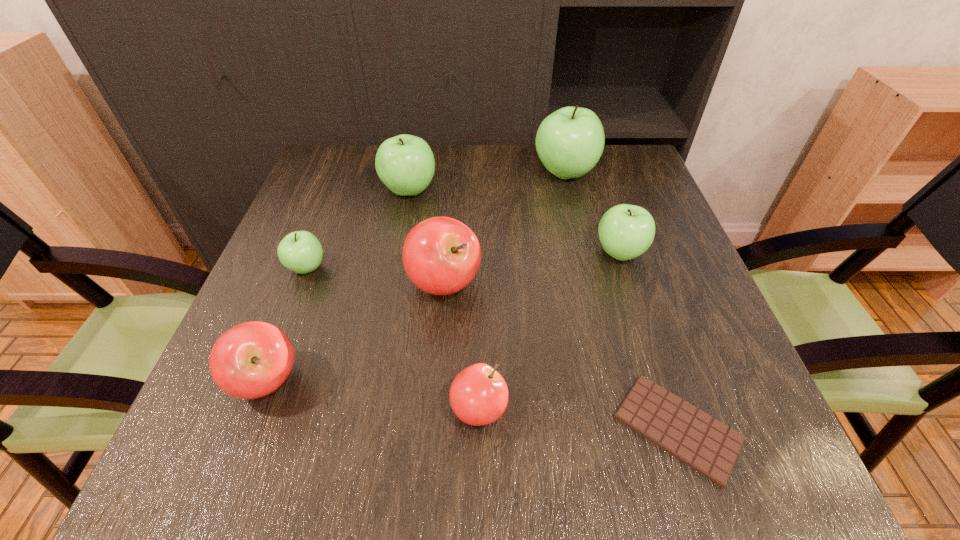
This screenshot has height=540, width=960. I want to click on vacant space situated 0.390m on the front of the biggest green apple, so click(x=598, y=311).

Where is `free space located on the right of the third green apple from right to left`? free space located on the right of the third green apple from right to left is located at coordinates (560, 190).

What are the coordinates of `vacant space situated 0.340m on the right of the farthest red apple` in the screenshot? It's located at (650, 283).

Identify the location of blank space located on the front of the second smallest green apple. The image size is (960, 540). (640, 316).

Find the location of `blank space located on the right of the second biggest red apple`. blank space located on the right of the second biggest red apple is located at coordinates (332, 380).

Locate an element on the screen. vacant space located on the front of the leftmost green apple is located at coordinates (272, 358).

At what (x,y) coordinates should I click in order to perform the action: click on vacant area located on the back of the smallest red apple. Please return your answer as a coordinate pair (x, y). Image resolution: width=960 pixels, height=540 pixels. Looking at the image, I should click on (479, 349).

I want to click on vacant space positioned 0.060m on the back of the shortest object, so click(x=651, y=348).

Locate an element on the screen. The height and width of the screenshot is (540, 960). apple present at the near edge is located at coordinates (478, 395).

The image size is (960, 540). Find the location of `chocolate bar that is positioned at the near edge`. chocolate bar that is positioned at the near edge is located at coordinates (708, 446).